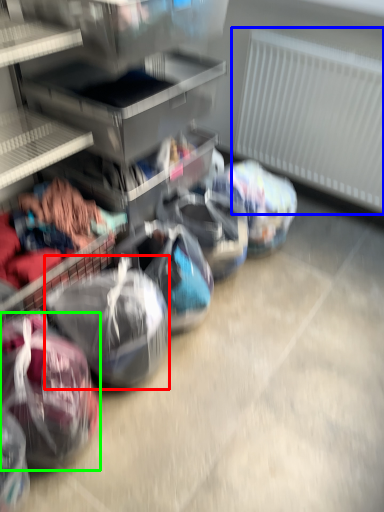
Question: Considering the real-world distances, which object is closest to sack (highlighted by a red box)? radiator (highlighted by a blue box) or sack (highlighted by a green box).

Choices:
 (A) radiator
 (B) sack

Answer: (B)